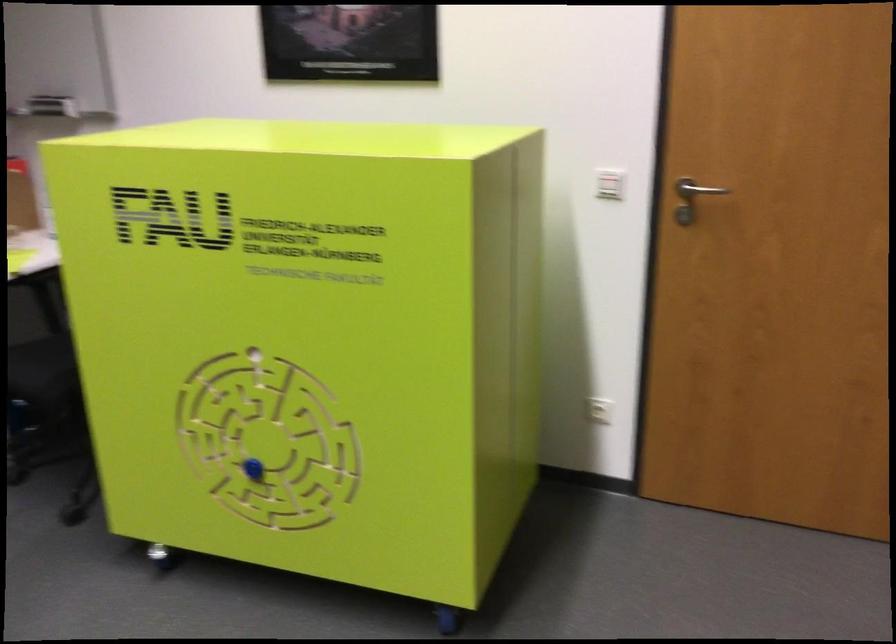
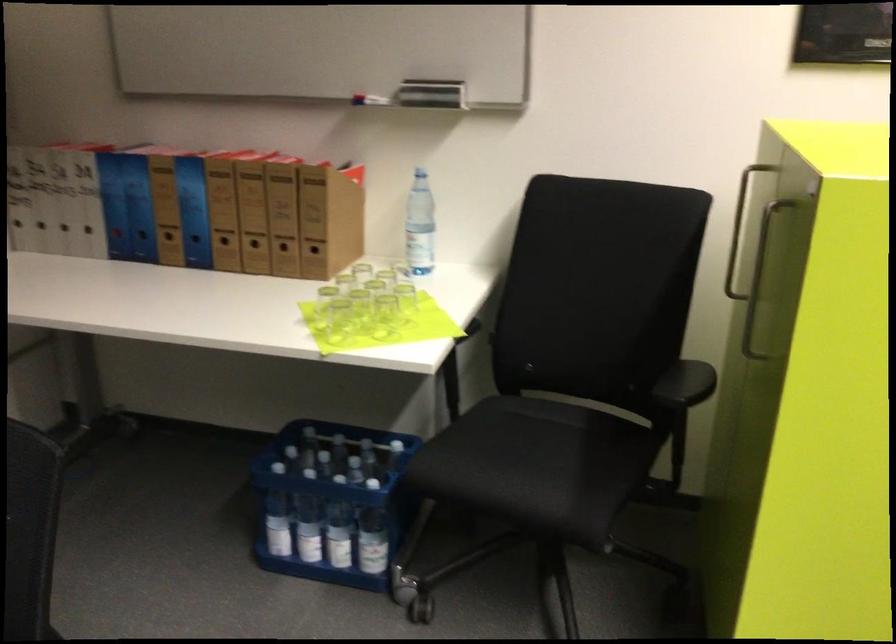
Which direction would the cameraman need to move to produce the second image?

The cameraman moved toward left, forward.